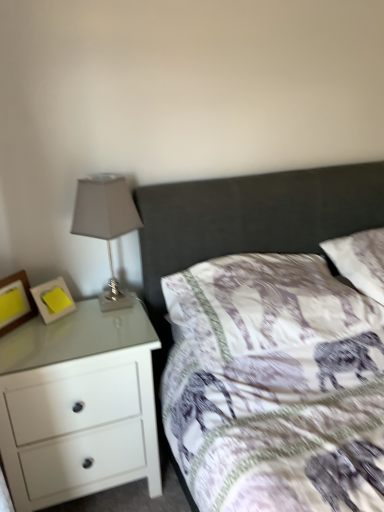
Locate an element on the screen. The height and width of the screenshot is (512, 384). free space to the right of yellow paper at left, marked as the 1th picture frame in a right-to-left arrangement is located at coordinates (96, 317).